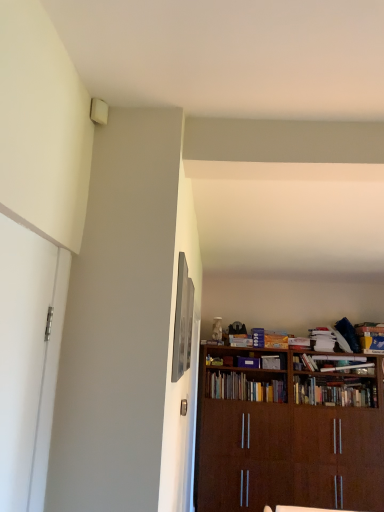
Question: From a real-world perspective, is blue cardboard book at right, which is the 1th book in right-to-left order, positioned over brown wooden bookcase at lower right based on gravity?

Choices:
 (A) no
 (B) yes

Answer: (B)

Question: Considering the relative positions of blue cardboard book at right, which is the 1th book in right-to-left order, and brown wooden bookcase at lower right in the image provided, is blue cardboard book at right, which is the 1th book in right-to-left order, to the right of brown wooden bookcase at lower right from the viewer's perspective?

Choices:
 (A) no
 (B) yes

Answer: (B)

Question: From a real-world perspective, is blue cardboard book at right, arranged as the fourth book when viewed from the left, positioned under brown wooden bookcase at lower right based on gravity?

Choices:
 (A) yes
 (B) no

Answer: (B)

Question: Considering the relative sizes of blue cardboard book at right, which is the 1th book in right-to-left order, and brown wooden bookcase at lower right in the image provided, is blue cardboard book at right, which is the 1th book in right-to-left order, bigger than brown wooden bookcase at lower right?

Choices:
 (A) no
 (B) yes

Answer: (A)

Question: Is blue cardboard book at right, which is the 1th book in right-to-left order, in front of brown wooden bookcase at lower right?

Choices:
 (A) no
 (B) yes

Answer: (A)

Question: Is blue cardboard book at right, arranged as the fourth book when viewed from the left, positioned beyond the bounds of brown wooden bookcase at lower right?

Choices:
 (A) no
 (B) yes

Answer: (B)

Question: From a real-world perspective, is wooden bookshelf at center, the 2th book viewed from the left, positioned under hardcover book at center, positioned as the second book in right-to-left order, based on gravity?

Choices:
 (A) yes
 (B) no

Answer: (A)

Question: Is wooden bookshelf at center, the 2th book viewed from the left, shorter than hardcover book at center, positioned as the second book in right-to-left order?

Choices:
 (A) yes
 (B) no

Answer: (B)

Question: Is wooden bookshelf at center, the 2th book viewed from the left, positioned with its back to hardcover book at center, positioned as the second book in right-to-left order?

Choices:
 (A) yes
 (B) no

Answer: (B)

Question: Is wooden bookshelf at center, the 3th book from the right, thinner than hardcover book at center, which is counted as the third book, starting from the left?

Choices:
 (A) no
 (B) yes

Answer: (A)

Question: Is wooden bookshelf at center, the 2th book viewed from the left, at the left side of hardcover book at center, positioned as the second book in right-to-left order?

Choices:
 (A) yes
 (B) no

Answer: (A)

Question: Is wooden bookshelf at center, the 3th book from the right, bigger than hardcover book at center, positioned as the second book in right-to-left order?

Choices:
 (A) no
 (B) yes

Answer: (B)

Question: Is brown wooden bookcase at lower right thinner than matte silver picture frame at upper center?

Choices:
 (A) yes
 (B) no

Answer: (B)